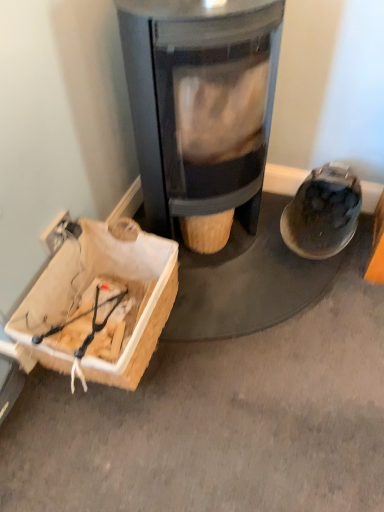
Question: From a real-world perspective, is wooden crate at lower left above or below matte black shoe at right?

Choices:
 (A) below
 (B) above

Answer: (A)

Question: Is wooden crate at lower left taller or shorter than matte black shoe at right?

Choices:
 (A) tall
 (B) short

Answer: (B)

Question: Which object is positioned farthest from the matte black shoe at right?

Choices:
 (A) matte black wood burning stove at center
 (B) wooden crate at lower left

Answer: (B)

Question: Estimate the real-world distances between objects in this image. Which object is closer to the wooden crate at lower left?

Choices:
 (A) matte black shoe at right
 (B) matte black wood burning stove at center

Answer: (B)